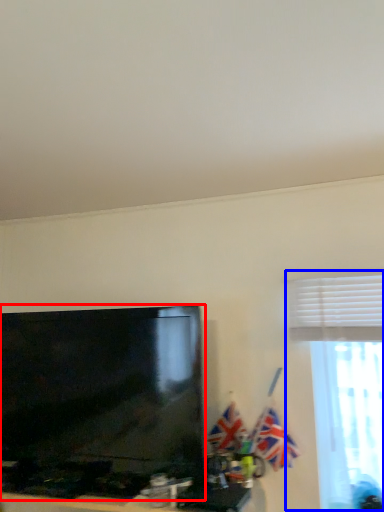
Question: Which of the following is the farthest to the observer, television (highlighted by a red box) or window (highlighted by a blue box)?

Choices:
 (A) television
 (B) window

Answer: (B)